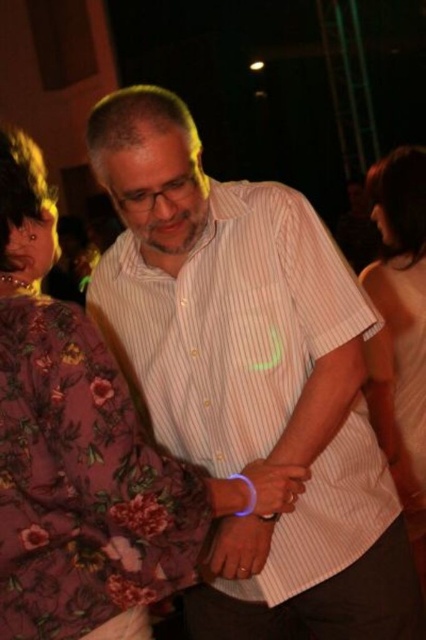
You are at a party and want to find the white striped shirt at center. Where is it located relative to the white matte tank top at upper right?

The white striped shirt at center is above the white matte tank top at upper right.

You are organizing a charity event and need to arrange two donated items on a shelf. The items are the white striped shirt at center and the white matte tank top at upper right. If the shelf has limited space, which item requires more horizontal space?

The white striped shirt at center requires more horizontal space because its width surpasses that of the white matte tank top at upper right.

Consider the image. You are organizing a clothing donation drive and need to categorize items based on their length. You have a white striped shirt at center and a white matte tank top at upper right. Which of these two items is shorter in length?

The white striped shirt at center is shorter than the white matte tank top at upper right, so the white striped shirt at center should be categorized as the shorter item.